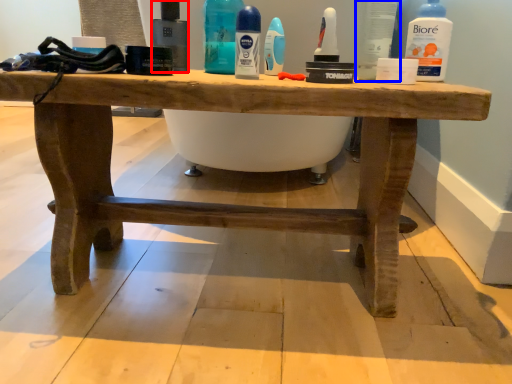
Question: Which point is further to the camera, mouthwash (highlighted by a red box) or toiletry (highlighted by a blue box)?

Choices:
 (A) mouthwash
 (B) toiletry

Answer: (A)